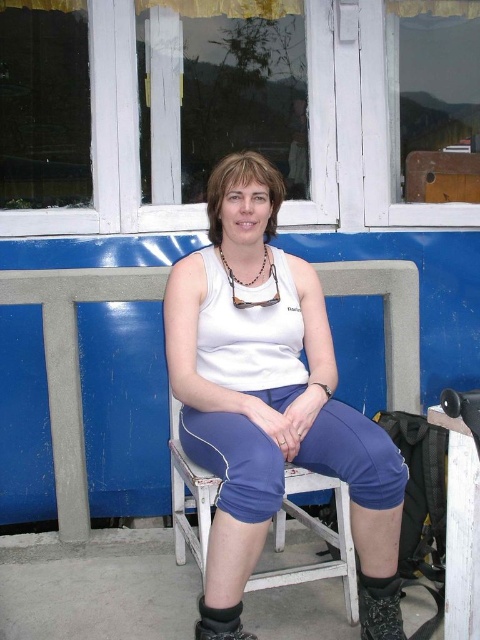
Question: Which object appears farthest from the camera in this image?

Choices:
 (A) white wooden chair at center
 (B) black suede boot at lower center

Answer: (B)

Question: Among these points, which one is farthest from the camera?

Choices:
 (A) (191, 372)
 (B) (324, 484)

Answer: (B)

Question: Is white matte tank top at center positioned in front of white wooden chair at center?

Choices:
 (A) no
 (B) yes

Answer: (B)

Question: Can you confirm if white matte tank top at center is smaller than black mesh boot at lower right?

Choices:
 (A) no
 (B) yes

Answer: (A)

Question: Can you confirm if black mesh boot at lower right is positioned below black suede boot at lower center?

Choices:
 (A) no
 (B) yes

Answer: (A)

Question: Which object appears farthest from the camera in this image?

Choices:
 (A) white matte tank top at center
 (B) black suede boot at lower center
 (C) white wooden chair at center

Answer: (B)